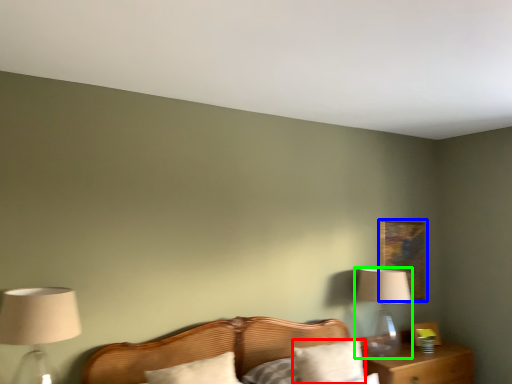
Question: Which object is positioned closest to pillow (highlighted by a red box)? Select from picture frame (highlighted by a blue box) and table lamp (highlighted by a green box).

Choices:
 (A) picture frame
 (B) table lamp

Answer: (B)